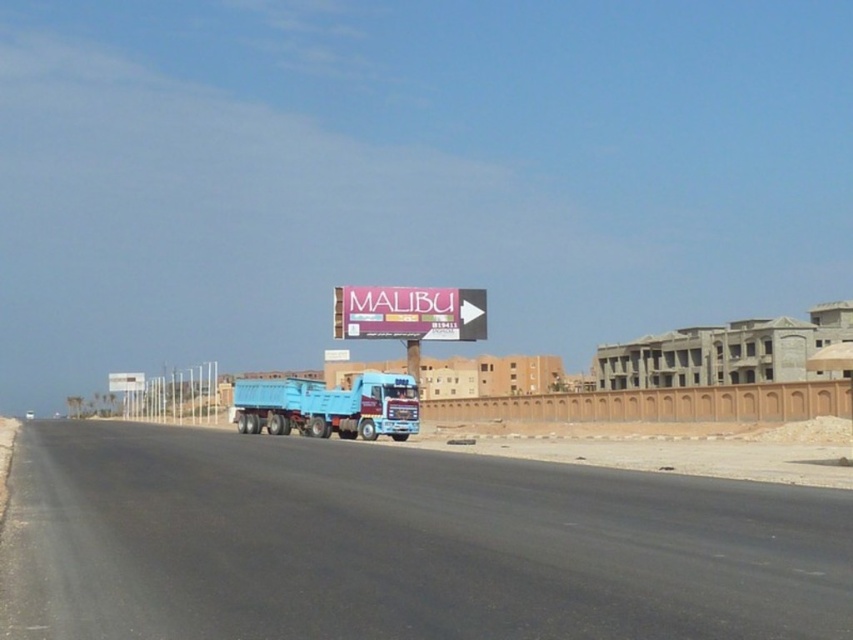
You are a delivery driver who needs to make a quick stop on the highway. You see a point at coordinates (399, 545). What is located at that point?

The point at coordinates (399, 545) is where the black asphalt highway at center is located.

You are a delivery driver planning to drive your truck on the black asphalt highway at center. There is a purple matte billboard at center nearby. Since both are at the center, which one should you prioritize staying on to safely continue your journey?

You should prioritize staying on the black asphalt highway at center because it has a larger size compared to the purple matte billboard at center, making it the appropriate path for driving.